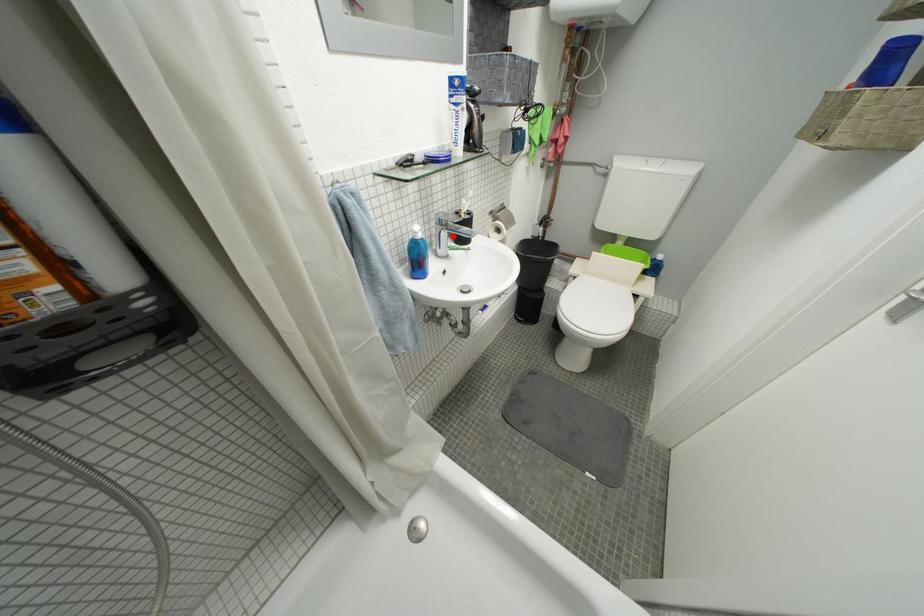
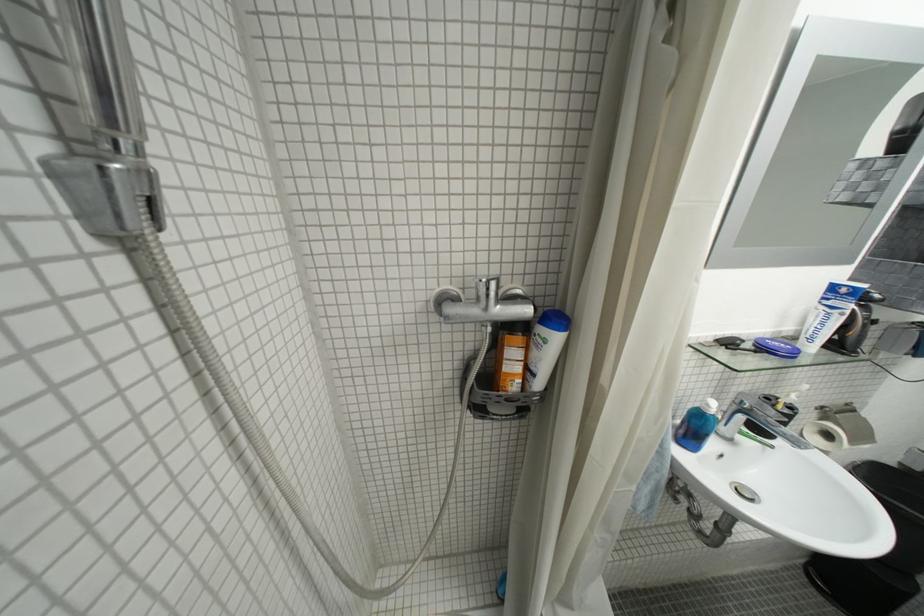
Locate, in the second image, the point that corresponds to the highlighted location in the first image.

(749, 419)